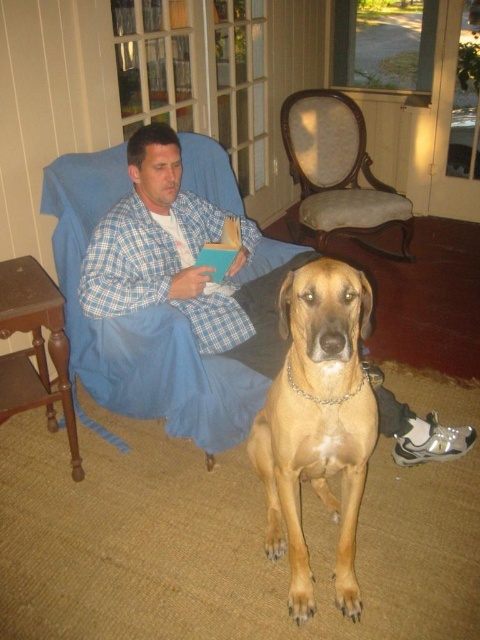
You are a delivery robot with a package that needs to be placed between the plaid pajama at center and the golden fur dog at center. The package is 25 inches long. Will it fit between them?

The plaid pajama at center and golden fur dog at center are 24.90 inches apart from each other. Since the package is 25 inches long, it will not fit between them as there is only 24.90 inches of space available.

Looking at this image, you are a photographer trying to capture a photo of both the plaid pajama at center and the golden fur dog at center. Since you want both subjects to be in focus, you need to know which one is taller. Can you tell me which one is taller?

The plaid pajama at center is taller than the golden fur dog at center, so you should adjust your camera settings to focus on the plaid pajama at center first as it is the taller object.

You are standing in the room and want to determine which of the two points, point (x=277, y=368) or point (x=328, y=188), is closer to you. Based on the scene description, which point is nearer?

Point (x=277, y=368) is closer to the camera than point (x=328, y=188), so it is nearer to you.